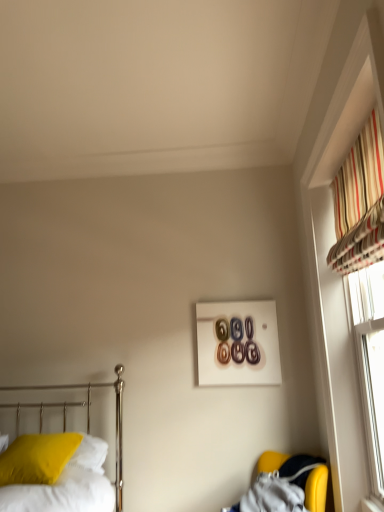
Where is `free space above striped fabric at upper right (from a real-world perspective)`? free space above striped fabric at upper right (from a real-world perspective) is located at coordinates (349, 136).